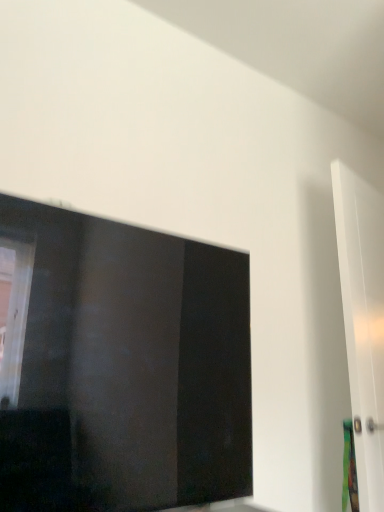
Question: Is transparent glass window at upper left in front of or behind white glossy door at right in the image?

Choices:
 (A) front
 (B) behind

Answer: (A)

Question: Would you say transparent glass window at upper left is inside or outside white glossy door at right?

Choices:
 (A) outside
 (B) inside

Answer: (A)

Question: From a real-world perspective, is transparent glass window at upper left physically located above or below white glossy door at right?

Choices:
 (A) above
 (B) below

Answer: (B)

Question: Visually, is white glossy door at right positioned to the left or to the right of transparent glass window at upper left?

Choices:
 (A) right
 (B) left

Answer: (A)

Question: From the image's perspective, is white glossy door at right above or below transparent glass window at upper left?

Choices:
 (A) below
 (B) above

Answer: (A)

Question: Relative to transparent glass window at upper left, is white glossy door at right in front or behind?

Choices:
 (A) front
 (B) behind

Answer: (B)

Question: Based on their sizes in the image, would you say white glossy door at right is bigger or smaller than transparent glass window at upper left?

Choices:
 (A) big
 (B) small

Answer: (B)